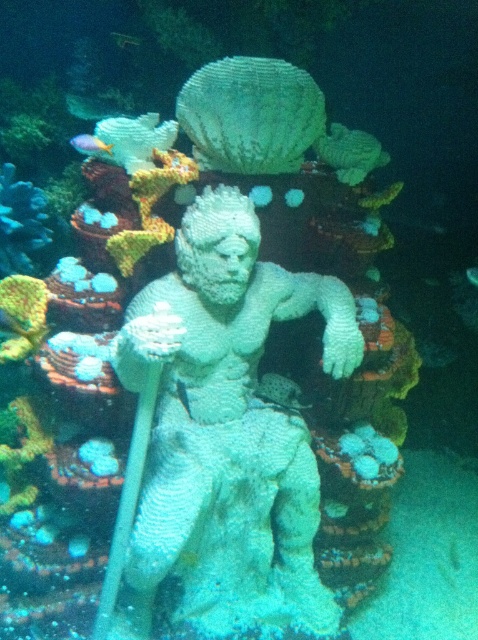
Question: Which object is the closest to the white textured statue at center?

Choices:
 (A) green translucent fish at center
 (B) shiny yellow fish at upper left

Answer: (B)

Question: Can you confirm if white textured statue at center is positioned below green translucent fish at center?

Choices:
 (A) yes
 (B) no

Answer: (A)

Question: Estimate the real-world distances between objects in this image. Which object is closer to the shiny yellow fish at upper left?

Choices:
 (A) green translucent fish at center
 (B) white textured statue at center

Answer: (B)

Question: Does white textured statue at center appear over green translucent fish at center?

Choices:
 (A) yes
 (B) no

Answer: (B)

Question: Which object is closer to the camera taking this photo?

Choices:
 (A) green translucent fish at center
 (B) shiny yellow fish at upper left
 (C) white textured statue at center

Answer: (C)

Question: Can you confirm if shiny yellow fish at upper left is positioned to the right of green translucent fish at center?

Choices:
 (A) no
 (B) yes

Answer: (A)